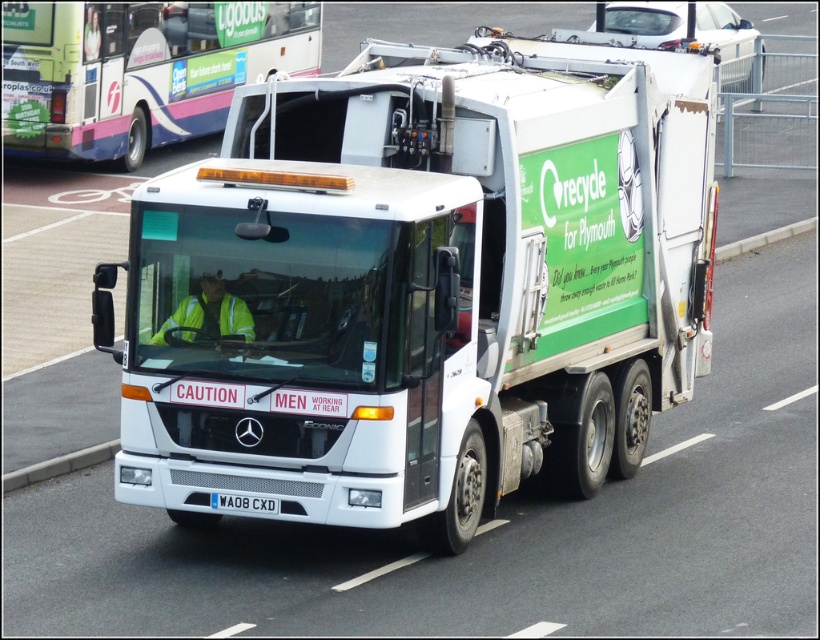
You are a pedestrian standing on the sidewalk next to the road where the white glossy truck at center and the white glossy bus at center are parked. You want to cross the road to reach a store on the other side. Which vehicle should you walk around to get to the store safely?

The white glossy truck at center is larger in size than the white glossy bus at center, so you should walk around the smaller vehicle, the white glossy bus at center, to ensure you have a shorter path and better visibility while crossing.

You are a city planner analyzing traffic flow. Given the truck is at coordinates 0.445, 0.516, which direction should you direct traffic to avoid blocking the white glossy truck at center?

The white glossy truck at center is located at coordinates (422, 284). To avoid blocking it, traffic should be directed around its position, ensuring vehicles do not obstruct the truck during its operations.

You are a pedestrian standing on the sidewalk. You see the white glossy bus at center and the white plastic license plate at center. Which object is closer to the left side of the road?

The white glossy bus at center is positioned on the left side of the white plastic license plate at center, so it is closer to the left side of the road.